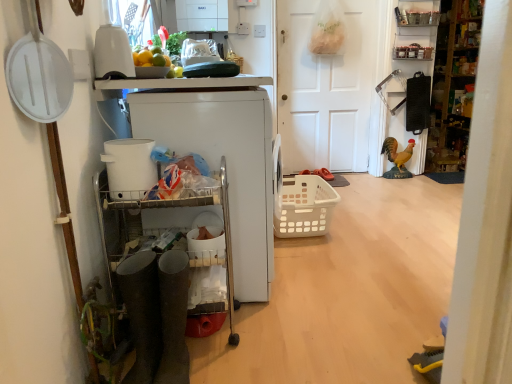
Where is `vacant space in front of white plastic basket at center`? This screenshot has width=512, height=384. vacant space in front of white plastic basket at center is located at coordinates (337, 264).